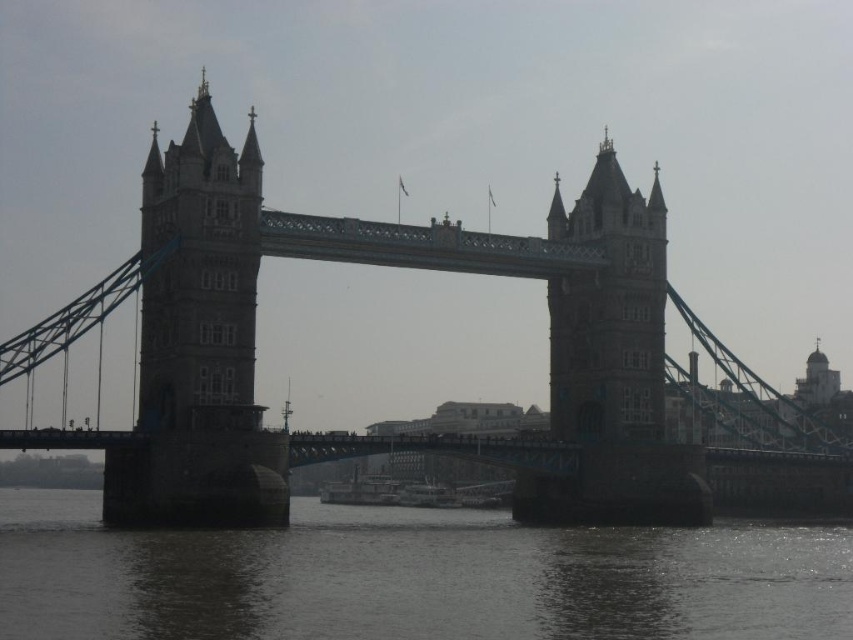
Question: Is brown stone suspension bridge at center to the left of brown stone tower at center from the viewer's perspective?

Choices:
 (A) yes
 (B) no

Answer: (A)

Question: Which point is closer to the camera taking this photo?

Choices:
 (A) (637, 428)
 (B) (625, 218)
 (C) (221, 284)

Answer: (C)

Question: In this image, where is brown stone suspension bridge at center located relative to gray stone tower at left?

Choices:
 (A) above
 (B) below

Answer: (B)

Question: Is dark gray water at lower center to the left of gray stone tower at left from the viewer's perspective?

Choices:
 (A) no
 (B) yes

Answer: (A)

Question: Among these objects, which one is nearest to the camera?

Choices:
 (A) brown stone suspension bridge at center
 (B) dark gray water at lower center

Answer: (B)

Question: Which object appears farthest from the camera in this image?

Choices:
 (A) gray stone tower at left
 (B) brown stone suspension bridge at center
 (C) dark gray water at lower center

Answer: (A)